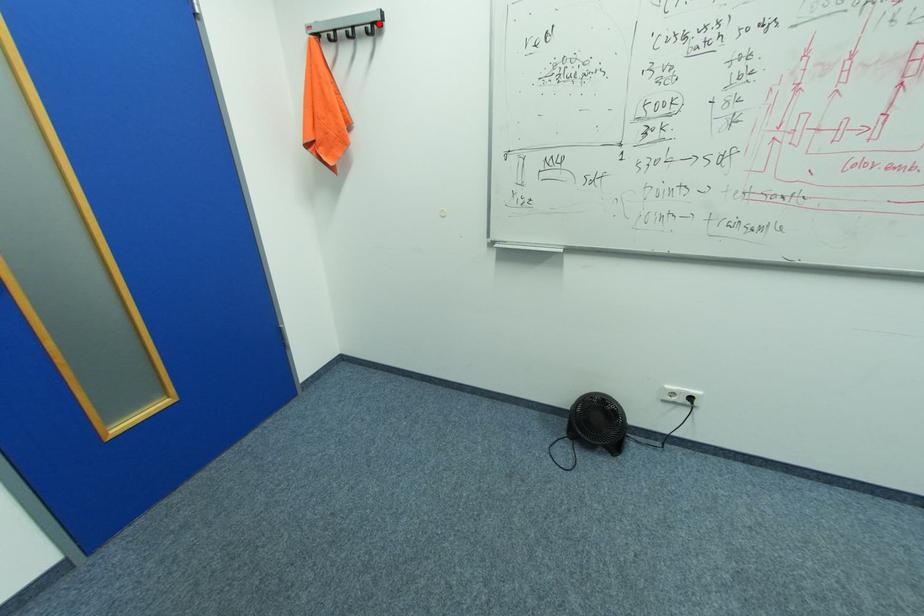
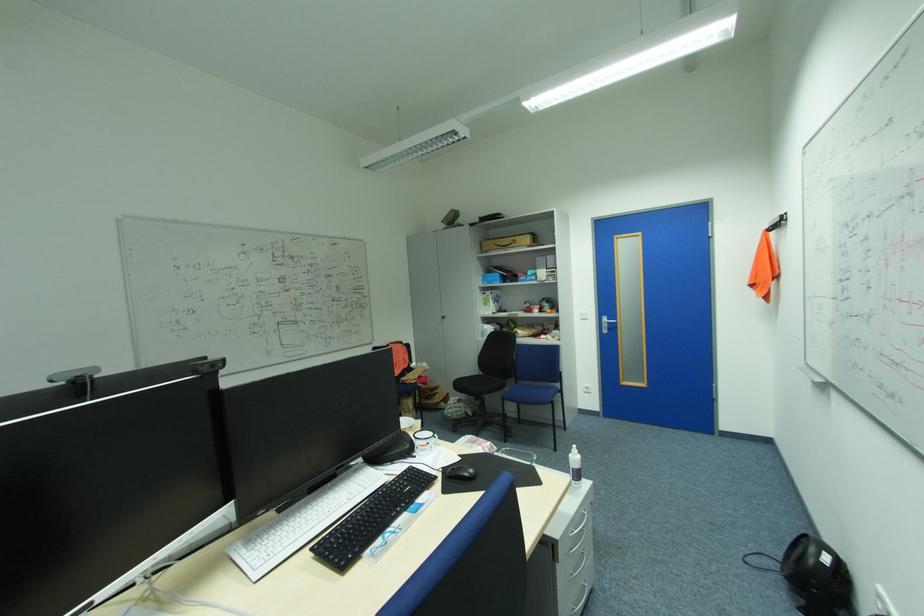
Question: I am providing you with two images of the same scene from different viewpoints. A red point is marked on the first image. At the location where the point appears in image 1, is it still visible in image 2?

Choices:
 (A) Yes
 (B) No

Answer: (B)